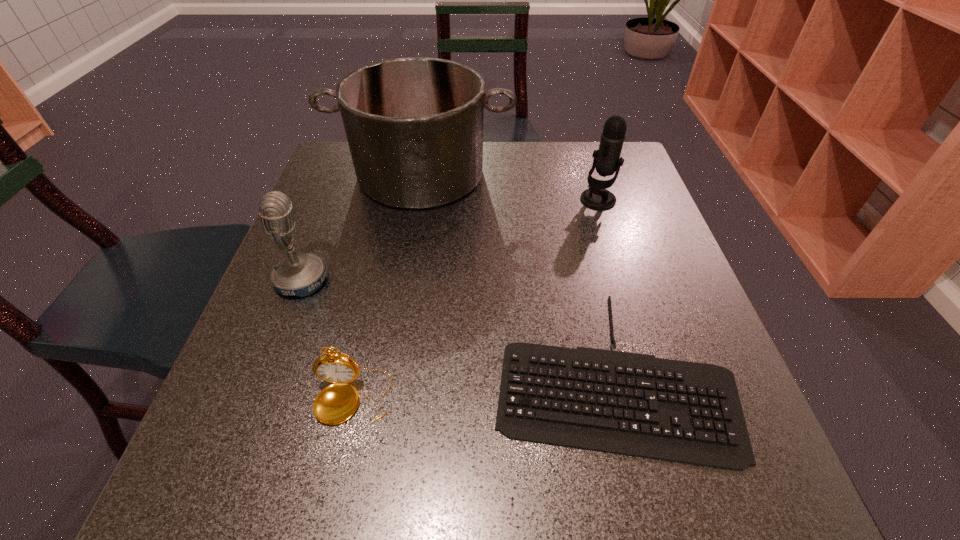
Find the location of a particular element. The width and height of the screenshot is (960, 540). pan that is at the far edge is located at coordinates (414, 126).

This screenshot has width=960, height=540. In order to click on microphone positioned at the far edge in this screenshot , I will do `click(607, 160)`.

Where is `object located at the near edge`? This screenshot has height=540, width=960. object located at the near edge is located at coordinates (634, 404).

You are a GUI agent. You are given a task and a screenshot of the screen. Output one action in this format:
    pyautogui.click(x=<x>, y=<y>)
    Task: Click on the pan positioned at the left edge
    This screenshot has width=960, height=540.
    Given the screenshot: What is the action you would take?
    pyautogui.click(x=414, y=126)

Locate an element on the screen. This screenshot has width=960, height=540. microphone that is at the left edge is located at coordinates (302, 274).

The height and width of the screenshot is (540, 960). Find the location of `pocket watch present at the left edge`. pocket watch present at the left edge is located at coordinates (336, 403).

The image size is (960, 540). Identify the location of microphone that is at the right edge. (607, 160).

In order to click on computer keyboard present at the right edge in this screenshot , I will do 634,404.

You are a GUI agent. You are given a task and a screenshot of the screen. Output one action in this format:
    pyautogui.click(x=<x>, y=<y>)
    Task: Click on the object positioned at the far left corner
    The width and height of the screenshot is (960, 540).
    Given the screenshot: What is the action you would take?
    pyautogui.click(x=414, y=126)

The image size is (960, 540). In order to click on object that is at the far right corner in this screenshot , I will do coord(607,160).